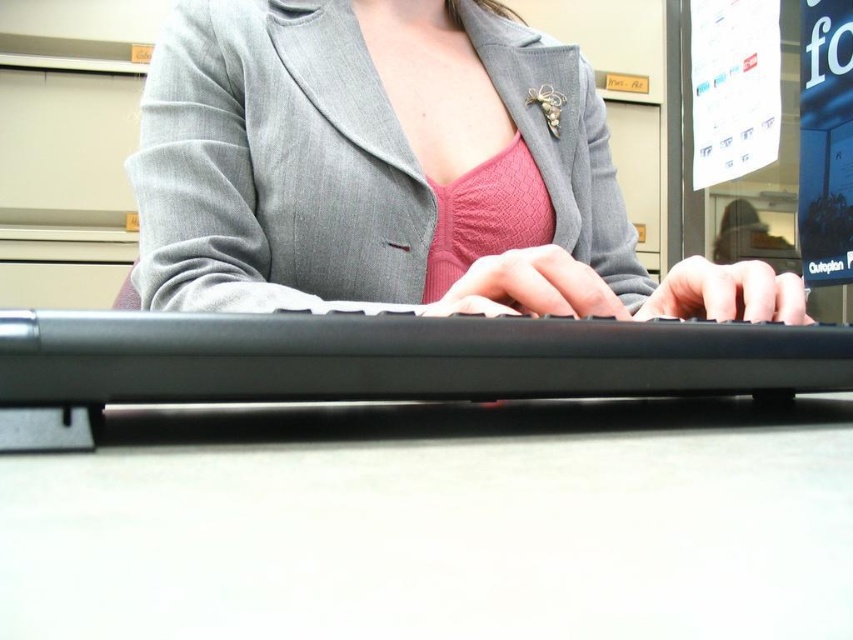
Question: Is white matte table at center to the right of black plastic keyboard at center from the viewer's perspective?

Choices:
 (A) yes
 (B) no

Answer: (A)

Question: Among these points, which one is farthest from the camera?

Choices:
 (A) (521, 344)
 (B) (161, 38)
 (C) (47, 522)

Answer: (B)

Question: Among these points, which one is nearest to the camera?

Choices:
 (A) (332, 364)
 (B) (393, 481)

Answer: (B)

Question: Is white matte table at center in front of black plastic keyboard at center?

Choices:
 (A) no
 (B) yes

Answer: (B)

Question: Is white matte table at center thinner than black plastic keyboard at center?

Choices:
 (A) no
 (B) yes

Answer: (A)

Question: Which point is farther to the camera?

Choices:
 (A) gray woolen blazer at center
 (B) black plastic keyboard at center

Answer: (A)